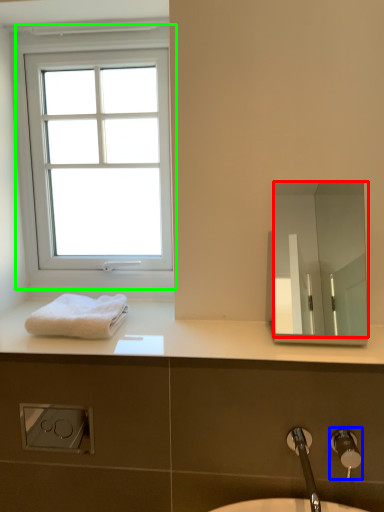
Question: Which is nearer to the mirror (highlighted by a red box)? plumbing fixture (highlighted by a blue box) or window (highlighted by a green box).

Choices:
 (A) plumbing fixture
 (B) window

Answer: (B)